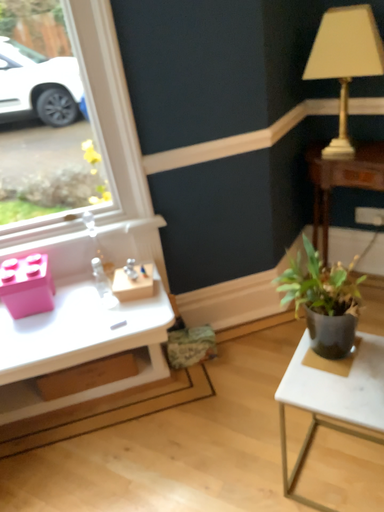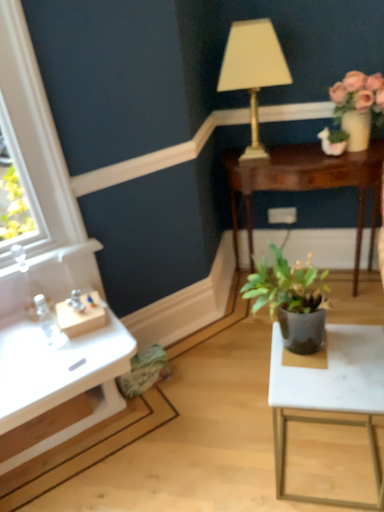
Question: How did the camera likely rotate when shooting the video?

Choices:
 (A) rotated right
 (B) rotated left

Answer: (A)